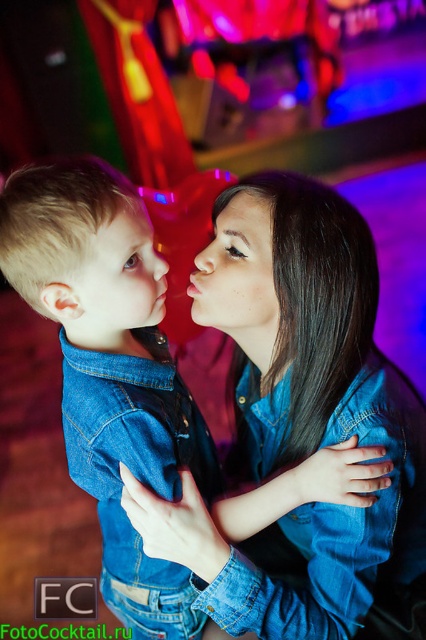
In the scene shown: Does denim shirt at center appear over matte blue denim shirt at center?

No.

Is point (100, 289) in front of point (143, 276)?

That is True.

Identify the location of denim shirt at center. The width and height of the screenshot is (426, 640). (103, 321).

Can you confirm if faded denim jacket at lower right is thinner than matte skin forehead at upper center?

Incorrect, faded denim jacket at lower right's width is not less than matte skin forehead at upper center's.

Which is behind, point (356, 595) or point (233, 198)?

Positioned behind is point (233, 198).

You are a GUI agent. You are given a task and a screenshot of the screen. Output one action in this format:
    pyautogui.click(x=<x>, y=<y>)
    Task: Click on the faded denim jacket at lower right
    
    Given the screenshot: What is the action you would take?
    pyautogui.click(x=336, y=529)

Image resolution: width=426 pixels, height=640 pixels. What are the coordinates of `faded denim jacket at lower right` in the screenshot? It's located at (336, 529).

Can you confirm if faded denim jacket at lower right is taller than matte skin at center?

Yes, faded denim jacket at lower right is taller than matte skin at center.

Is point (379, 400) closer to camera compared to point (270, 227)?

No, (379, 400) is further to viewer.

The width and height of the screenshot is (426, 640). In order to click on faded denim jacket at lower right in this screenshot , I will do `click(336, 529)`.